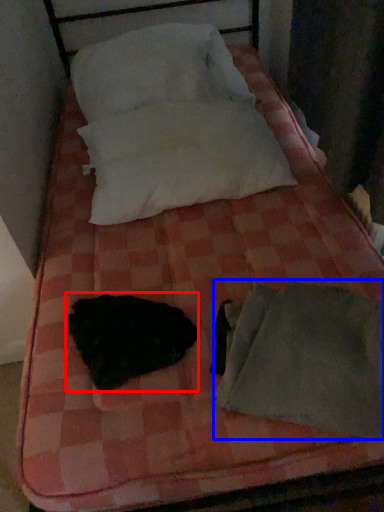
Question: Which object is further to the camera taking this photo, animal (highlighted by a red box) or sleeping bag (highlighted by a blue box)?

Choices:
 (A) animal
 (B) sleeping bag

Answer: (A)